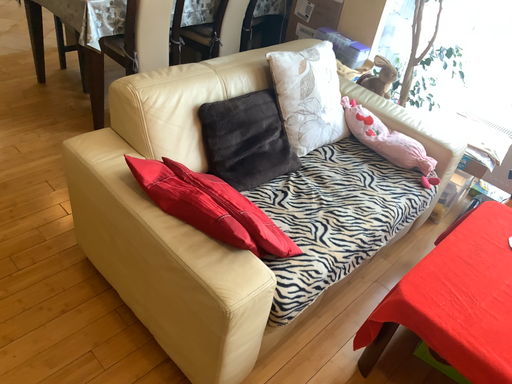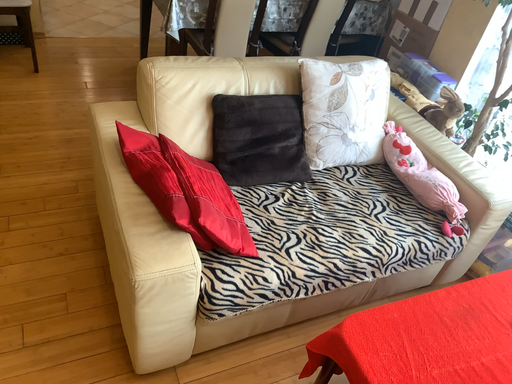
Question: Which way did the camera rotate in the video?

Choices:
 (A) rotated left
 (B) rotated right

Answer: (A)